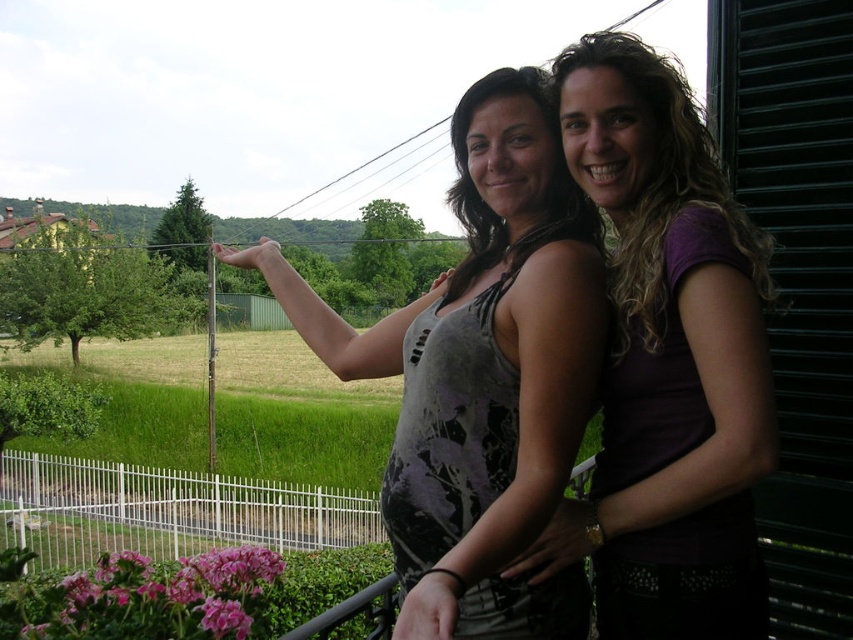
You are a photographer trying to capture both women in a frame. Given that the gray printed tank top at center and the purple matte tank top at center are both at the center, which woman should you adjust to be closer to the edge to ensure both fit comfortably in the photo?

Since the gray printed tank top at center is wider than the purple matte tank top at center, you should adjust the woman wearing the gray printed tank top at center to move closer to the edge to make space for both in the photo.

You are a photographer trying to capture a candid shot of both the gray printed tank top at center and the purple matte shirt at upper right. Given that your camera has a maximum focus range of 20 inches, will you be able to focus on both subjects simultaneously?

The distance between the gray printed tank top at center and the purple matte shirt at upper right is 21.70 inches, which exceeds the camera maximum focus range of 20 inches. Therefore, you cannot focus on both subjects simultaneously.